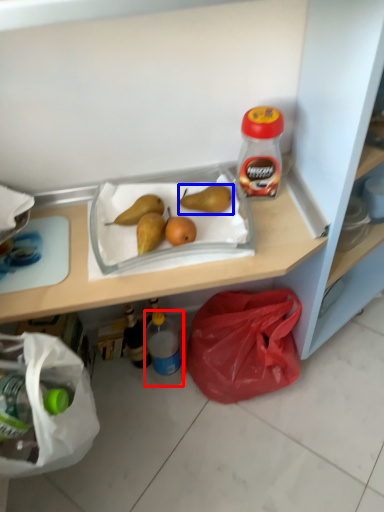
Question: Among these objects, which one is farthest to the camera, bottle (highlighted by a red box) or pear (highlighted by a blue box)?

Choices:
 (A) bottle
 (B) pear

Answer: (A)